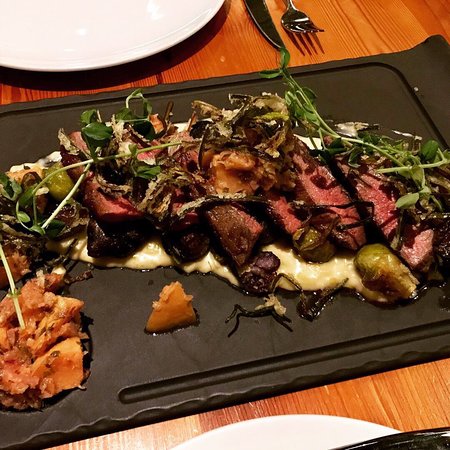
The image size is (450, 450). What are the coordinates of `grooved border in tray` in the screenshot? It's located at (212, 378), (419, 109), (231, 86).